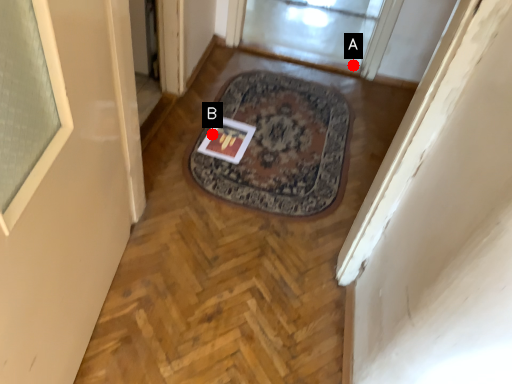
Question: Two points are circled on the image, labeled by A and B beside each circle. Which point is closer to the camera?

Choices:
 (A) A is closer
 (B) B is closer

Answer: (B)